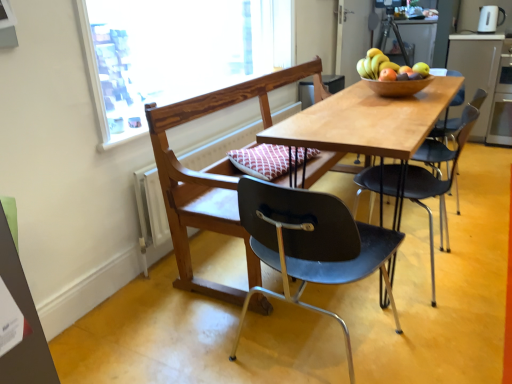
This screenshot has width=512, height=384. I want to click on free location in front of matte black chair at center, which is the 3th chair from front to back, so click(x=445, y=319).